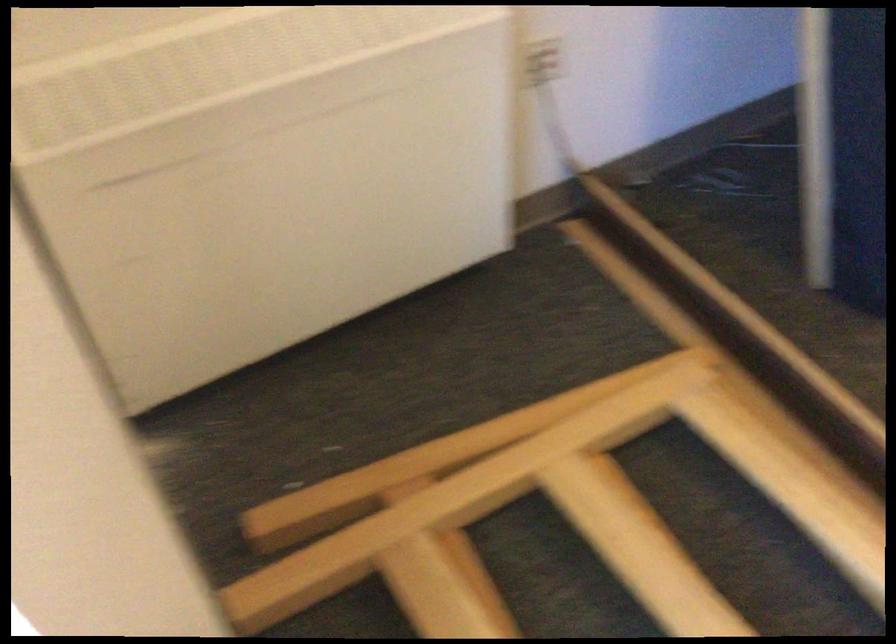
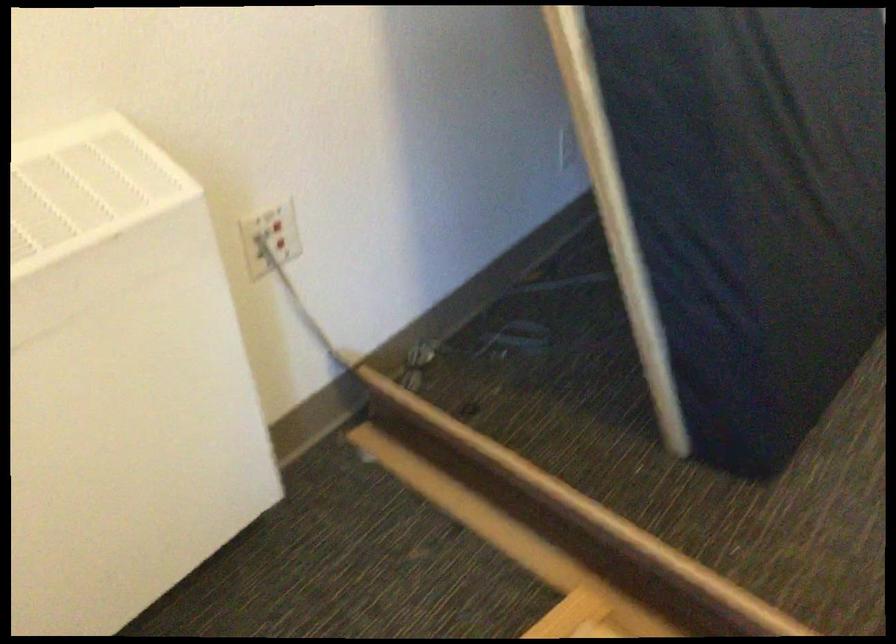
Question: In a continuous first-person perspective shot, in which direction is the camera moving?

Choices:
 (A) Left
 (B) Right
 (C) Forward
 (D) Backward

Answer: (C)